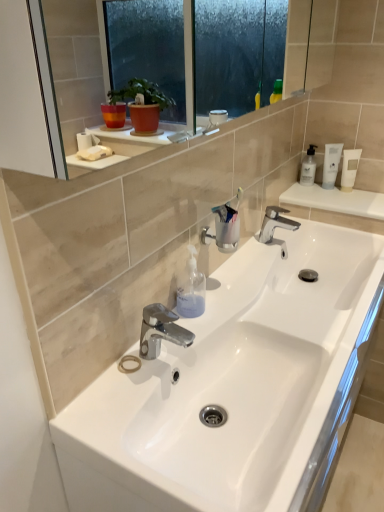
Question: From a real-world perspective, is white matte tube at upper right positioned under chrome metallic faucet at center, placed as the first tap when sorted from front to back, based on gravity?

Choices:
 (A) no
 (B) yes

Answer: (A)

Question: Can you confirm if white matte tube at upper right is thinner than chrome metallic faucet at center, the second tap in the top-to-bottom sequence?

Choices:
 (A) no
 (B) yes

Answer: (B)

Question: Is white matte tube at upper right oriented away from chrome metallic faucet at center, marked as the second tap in a back-to-front arrangement?

Choices:
 (A) yes
 (B) no

Answer: (B)

Question: From the image's perspective, is white matte tube at upper right beneath chrome metallic faucet at center, placed as the first tap when sorted from front to back?

Choices:
 (A) yes
 (B) no

Answer: (B)

Question: Considering the relative positions of white matte tube at upper right and chrome metallic faucet at center, placed as the first tap when sorted from front to back, in the image provided, is white matte tube at upper right behind chrome metallic faucet at center, placed as the first tap when sorted from front to back,?

Choices:
 (A) no
 (B) yes

Answer: (B)

Question: Considering the positions of white glossy sink at center and polished chrome faucet at center, positioned as the 1th tap in top-to-bottom order, in the image, is white glossy sink at center bigger or smaller than polished chrome faucet at center, positioned as the 1th tap in top-to-bottom order,?

Choices:
 (A) small
 (B) big

Answer: (B)

Question: From the image's perspective, is white glossy sink at center positioned above or below polished chrome faucet at center, the 2th tap from the left?

Choices:
 (A) below
 (B) above

Answer: (A)

Question: From their relative heights in the image, would you say white glossy sink at center is taller or shorter than polished chrome faucet at center, the 2th tap from the bottom?

Choices:
 (A) tall
 (B) short

Answer: (A)

Question: Is white glossy sink at center situated inside polished chrome faucet at center, positioned as the 2th tap in front-to-back order, or outside?

Choices:
 (A) inside
 (B) outside

Answer: (B)

Question: From a real-world perspective, is white matte bottle at upper right above or below clear plastic cup at center?

Choices:
 (A) above
 (B) below

Answer: (B)

Question: Does point (306, 160) appear closer or farther from the camera than point (220, 212)?

Choices:
 (A) farther
 (B) closer

Answer: (A)

Question: From their relative heights in the image, would you say white matte bottle at upper right is taller or shorter than clear plastic cup at center?

Choices:
 (A) short
 (B) tall

Answer: (A)

Question: Choose the correct answer: Is white matte bottle at upper right inside clear plastic cup at center or outside it?

Choices:
 (A) outside
 (B) inside

Answer: (A)

Question: Which is correct: polished chrome faucet at center, the 2th tap from the bottom, is inside transparent plastic soap dispenser at center, arranged as the second toiletry when viewed from the top, or outside of it?

Choices:
 (A) inside
 (B) outside

Answer: (B)

Question: In terms of height, does polished chrome faucet at center, positioned as the 1th tap in top-to-bottom order, look taller or shorter compared to transparent plastic soap dispenser at center, arranged as the second toiletry when viewed from the back?

Choices:
 (A) short
 (B) tall

Answer: (A)